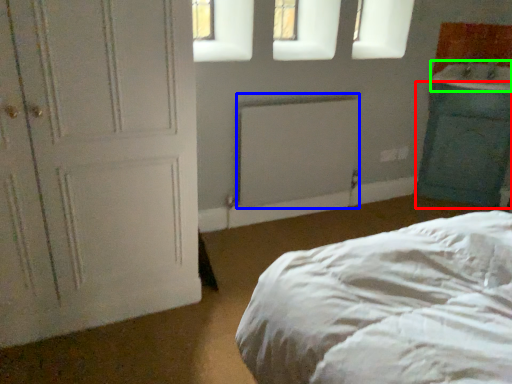
Question: Which object is the closest to the cabinetry (highlighted by a red box)? Choose among these: radiator (highlighted by a blue box) or sink (highlighted by a green box).

Choices:
 (A) radiator
 (B) sink

Answer: (B)